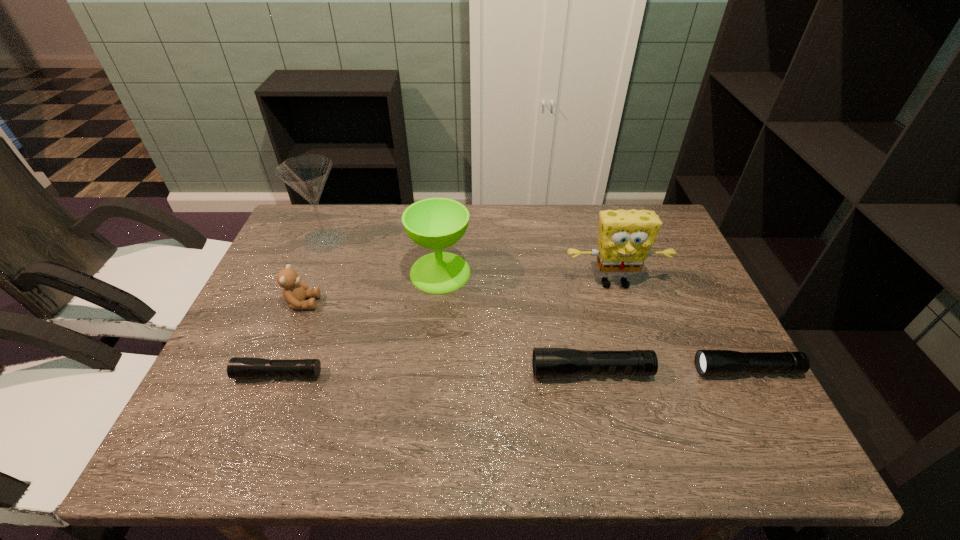
Please point a space for a new flashlight to maintain equal intervals. Please provide its 2D coordinates. Your answer should be formatted as a tuple, i.e. [(x, y)], where the tuple contains the x and y coordinates of a point satisfying the conditions above.

[(435, 373)]